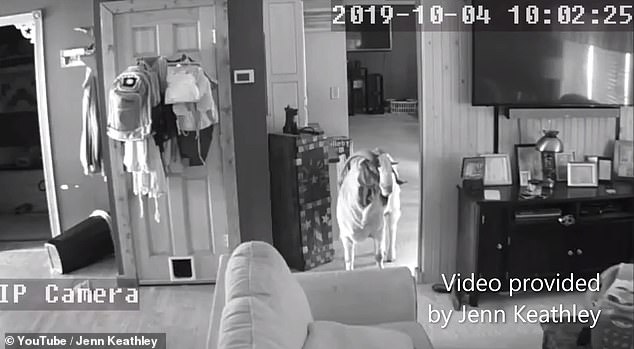
Where is `door`? Image resolution: width=634 pixels, height=349 pixels. door is located at coordinates (158, 215).